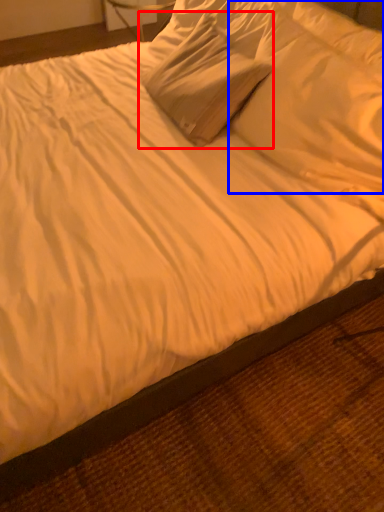
Question: Which of the following is the farthest to the observer, pillow (highlighted by a red box) or pillow (highlighted by a blue box)?

Choices:
 (A) pillow
 (B) pillow

Answer: (A)